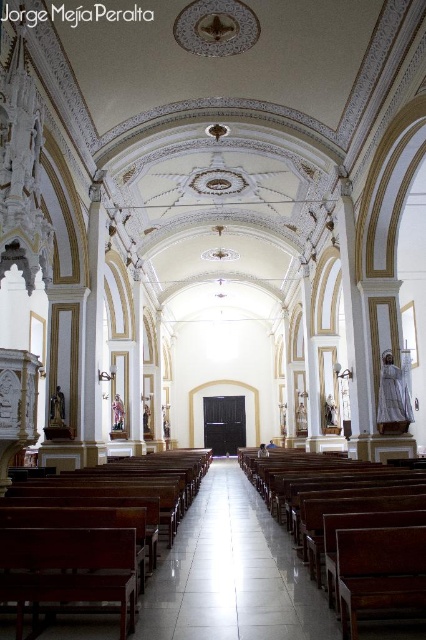
Question: Is polished wood bench at center to the left of wooden church bench at center from the viewer's perspective?

Choices:
 (A) yes
 (B) no

Answer: (A)

Question: Among these objects, which one is farthest from the camera?

Choices:
 (A) wooden church bench at center
 (B) polished wood bench at center

Answer: (A)

Question: Does polished wood bench at center have a lesser width compared to wooden church bench at center?

Choices:
 (A) no
 (B) yes

Answer: (B)

Question: Does polished wood bench at center have a larger size compared to wooden church bench at center?

Choices:
 (A) yes
 (B) no

Answer: (B)